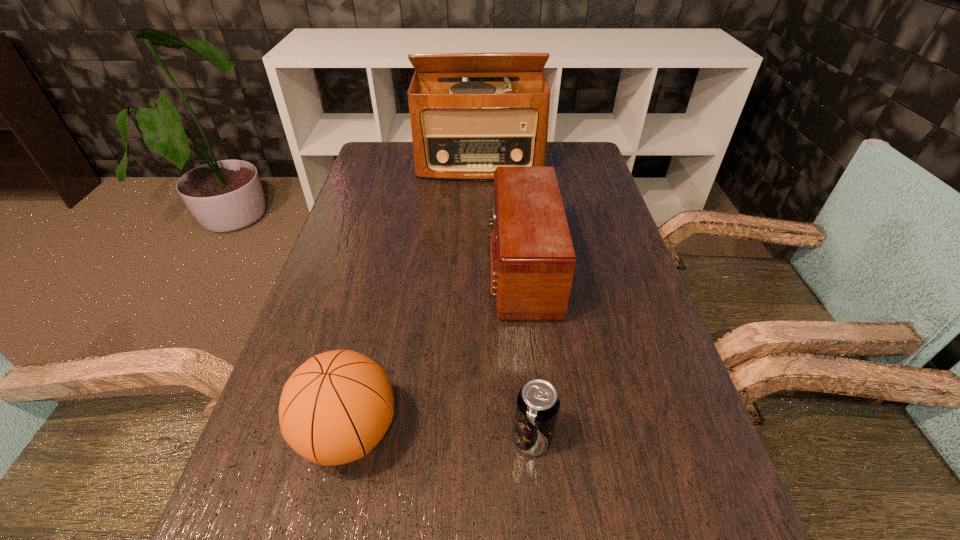
At what (x,y) coordinates should I click in order to perform the action: click on unoccupied position between the taller radio receiver and the basketball. Please return your answer as a coordinate pair (x, y). Image resolution: width=960 pixels, height=540 pixels. Looking at the image, I should click on (415, 299).

Locate an element on the screen. vacant space that's between the third nearest object and the basketball is located at coordinates (435, 350).

This screenshot has height=540, width=960. I want to click on vacant area that lies between the basketball and the farther radio receiver, so click(x=415, y=299).

Where is `empty space that is in between the basketball and the nearer radio receiver`? The width and height of the screenshot is (960, 540). empty space that is in between the basketball and the nearer radio receiver is located at coordinates (435, 350).

The width and height of the screenshot is (960, 540). Identify the location of vacant space in between the tallest object and the basketball. (415, 299).

Identify the location of free point between the farthest object and the basketball. The image size is (960, 540). (415, 299).

Select which object appears as the third closest to the shortest object. Please provide its 2D coordinates. Your answer should be formatted as a tuple, i.e. [(x, y)], where the tuple contains the x and y coordinates of a point satisfying the conditions above.

[(461, 130)]

Image resolution: width=960 pixels, height=540 pixels. In order to click on the closest object to the shortest object in this screenshot , I will do `click(336, 407)`.

The height and width of the screenshot is (540, 960). Find the location of `vacant position in the image that satisfies the following two spatial constraints: 1. on the front panel of the shortest object; 2. on the right side of the tallest object`. vacant position in the image that satisfies the following two spatial constraints: 1. on the front panel of the shortest object; 2. on the right side of the tallest object is located at coordinates (481, 439).

Find the location of a particular element. free point that satisfies the following two spatial constraints: 1. on the front panel of the farthest object; 2. on the right side of the shortest object is located at coordinates (481, 439).